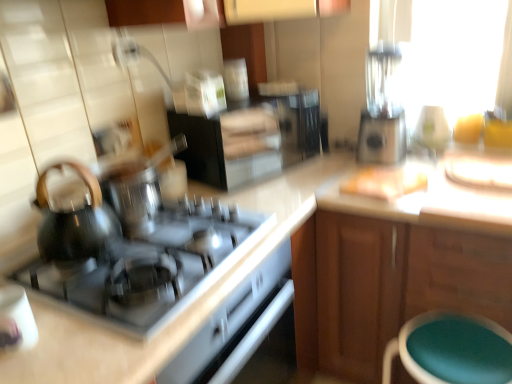
Question: Considering the relative sizes of wooden cabinet at right and sleek silver blender at upper right in the image provided, is wooden cabinet at right smaller than sleek silver blender at upper right?

Choices:
 (A) no
 (B) yes

Answer: (A)

Question: Is wooden cabinet at right outside sleek silver blender at upper right?

Choices:
 (A) yes
 (B) no

Answer: (A)

Question: Is wooden cabinet at right taller than sleek silver blender at upper right?

Choices:
 (A) yes
 (B) no

Answer: (A)

Question: Does wooden cabinet at right have a lesser height compared to sleek silver blender at upper right?

Choices:
 (A) yes
 (B) no

Answer: (B)

Question: Would you say wooden cabinet at right is a long distance from sleek silver blender at upper right?

Choices:
 (A) no
 (B) yes

Answer: (A)

Question: In terms of width, does shiny black kettle at left look wider or thinner when compared to shiny black cooktop at center-left?

Choices:
 (A) wide
 (B) thin

Answer: (B)

Question: From a real-world perspective, is shiny black kettle at left positioned above or below shiny black cooktop at center-left?

Choices:
 (A) above
 (B) below

Answer: (A)

Question: Is shiny black kettle at left bigger or smaller than shiny black cooktop at center-left?

Choices:
 (A) small
 (B) big

Answer: (A)

Question: Is point (38, 248) closer or farther from the camera than point (126, 299)?

Choices:
 (A) closer
 (B) farther

Answer: (B)

Question: Looking at the image, does sleek silver blender at upper right seem bigger or smaller compared to shiny black kettle at left?

Choices:
 (A) small
 (B) big

Answer: (B)

Question: Is sleek silver blender at upper right spatially inside shiny black kettle at left, or outside of it?

Choices:
 (A) outside
 (B) inside

Answer: (A)

Question: Is sleek silver blender at upper right wider or thinner than shiny black kettle at left?

Choices:
 (A) wide
 (B) thin

Answer: (A)

Question: From their relative heights in the image, would you say sleek silver blender at upper right is taller or shorter than shiny black kettle at left?

Choices:
 (A) tall
 (B) short

Answer: (A)

Question: Would you say teal fabric stool at lower right is to the left or to the right of sleek silver blender at upper right in the picture?

Choices:
 (A) right
 (B) left

Answer: (A)

Question: In terms of height, does teal fabric stool at lower right look taller or shorter compared to sleek silver blender at upper right?

Choices:
 (A) short
 (B) tall

Answer: (A)